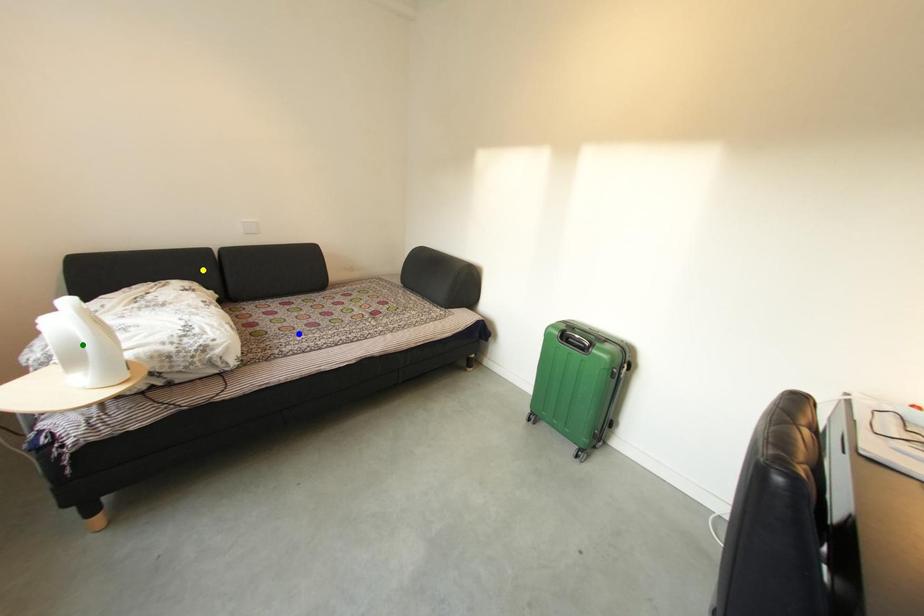
Order these from farthest to nearest:
- yellow point
- blue point
- green point

1. yellow point
2. blue point
3. green point